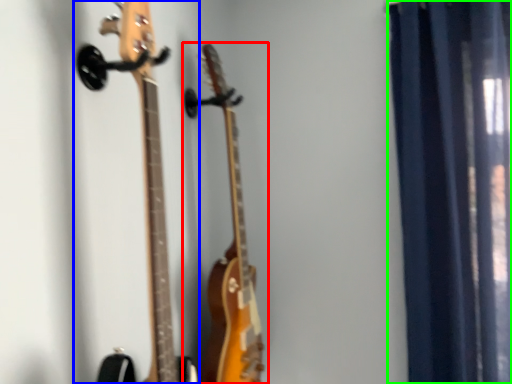
Question: Estimate the real-world distances between objects in this image. Which object is closer to guitar (highlighted by a red box), guitar (highlighted by a blue box) or curtain (highlighted by a green box)?

Choices:
 (A) guitar
 (B) curtain

Answer: (A)